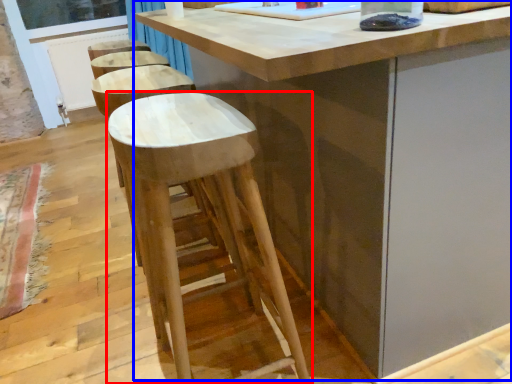
Question: Among these objects, which one is nearest to the camera, stool (highlighted by a red box) or table (highlighted by a blue box)?

Choices:
 (A) stool
 (B) table

Answer: (A)